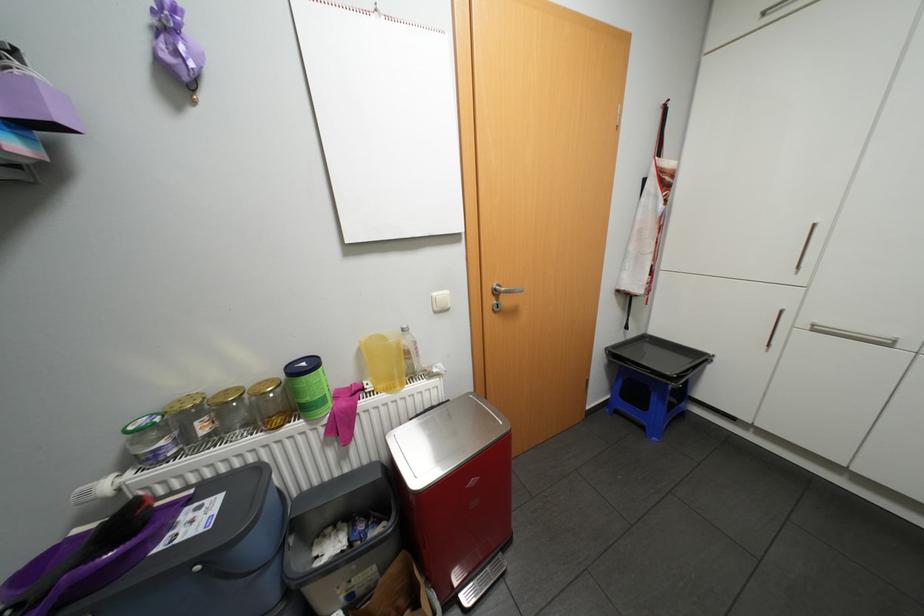
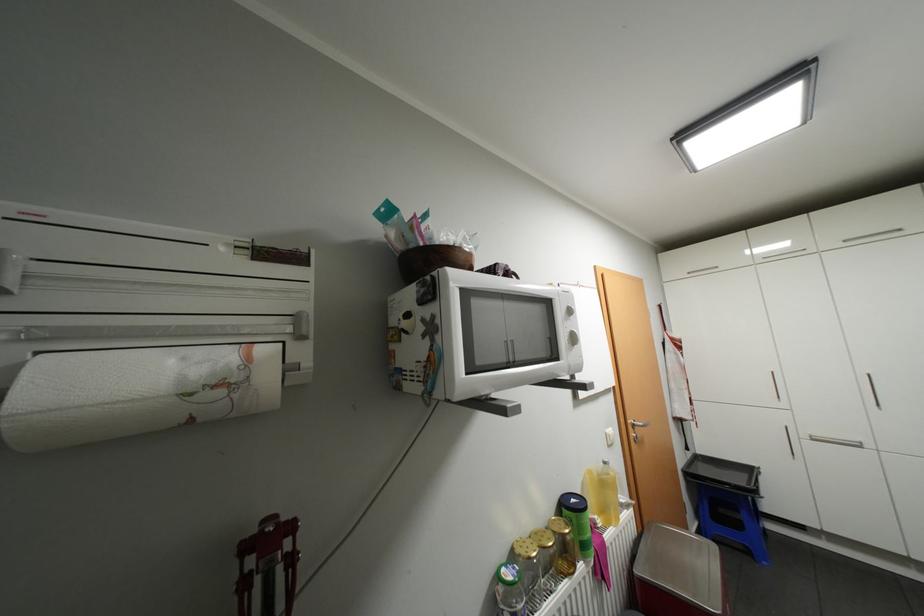
Question: I am providing you with two images of the same scene from different viewpoints. Which of the following objects are not visible in image2?

Choices:
 (A) dispenser slider
 (B) large yellow bottle
 (C) white microwave dial
 (D) none of these

Answer: (D)